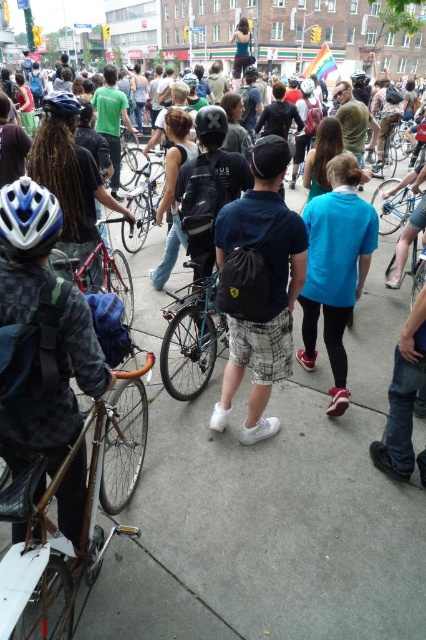
You are a cyclist participating in a city tour and you see the shiny silver bicycle at center and the white matte bicycle helmet at center. Which object is located higher in the image?

The white matte bicycle helmet at center is higher because it is positioned above the shiny silver bicycle at center.

You are standing at the camera position observing the scene. There are two points in the image labeled as point 1 at coordinates point (149,182) and point 2 at coordinates point (307,88). Which point is closer to you?

Point (149,182) is closer to the camera than point (307,88).

In the scene shown: Please look at the scene described. There is a point marked at coordinates (334, 268). What object or person is located at this point?

The point at coordinates (334, 268) marks the blue matte shirt at center.